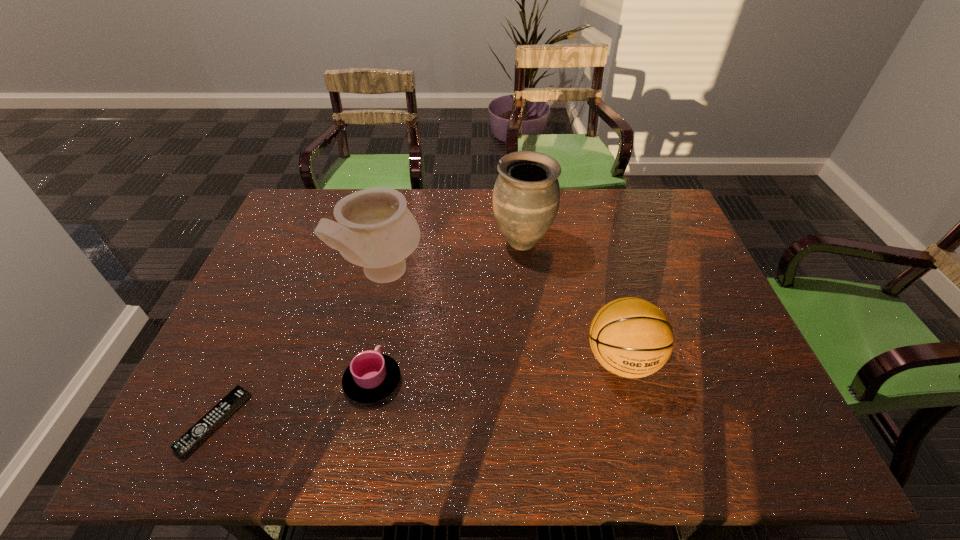
Find the location of a particular element. The width and height of the screenshot is (960, 540). pottery is located at coordinates (375, 230).

Where is `urn`? urn is located at coordinates pyautogui.click(x=526, y=195).

You are a GUI agent. You are given a task and a screenshot of the screen. Output one action in this format:
    pyautogui.click(x=<x>, y=<y>)
    Task: Click on the rightmost object
    The width and height of the screenshot is (960, 540).
    Given the screenshot: What is the action you would take?
    pyautogui.click(x=630, y=337)

The height and width of the screenshot is (540, 960). What are the coordinates of `the third shortest object` in the screenshot? It's located at (630, 337).

Locate an element on the screen. The height and width of the screenshot is (540, 960). cup is located at coordinates (371, 376).

Where is `the shortest object`? the shortest object is located at coordinates (198, 433).

Image resolution: width=960 pixels, height=540 pixels. In order to click on the leftmost object in this screenshot , I will do `click(198, 433)`.

Where is `vacant space situated on the front of the pottery`? Image resolution: width=960 pixels, height=540 pixels. vacant space situated on the front of the pottery is located at coordinates (358, 386).

Image resolution: width=960 pixels, height=540 pixels. Identify the location of vacant space situated on the back of the urn. (519, 213).

Locate an element on the screen. free space located 0.270m on the side with the handle of the second shortest object is located at coordinates (393, 278).